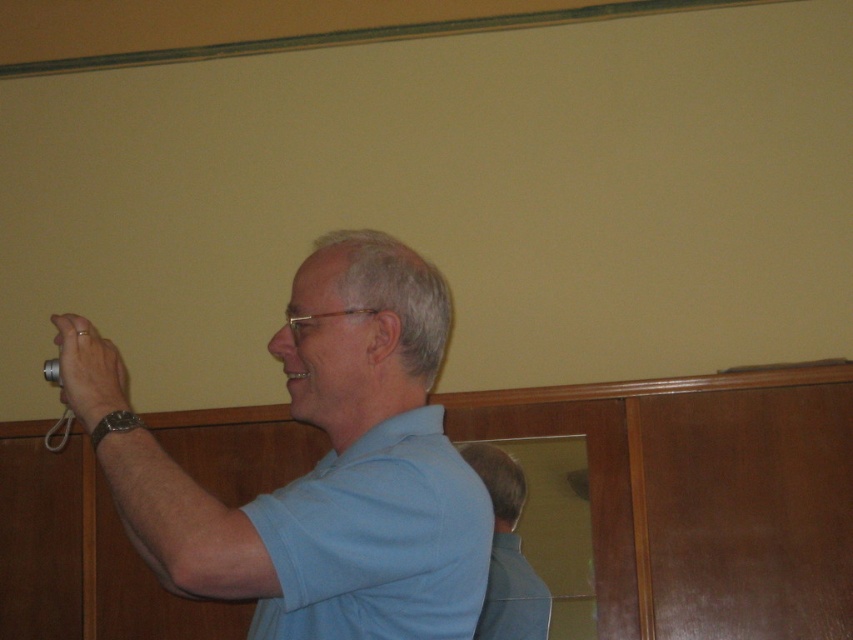
You are a photographer trying to decide which blue shirt to wear for a photoshoot. You see both the blue matte shirt at center and the blue fabric shirt at center in the image. Which one is bigger?

The blue matte shirt at center is larger in size compared to the blue fabric shirt at center.

You are a photographer trying to adjust your setup. The blue fabric shirt at center and the matte silver camera at left are in your frame. Which object is closer to the bottom edge of your camera viewfinder?

The blue fabric shirt at center is positioned under the matte silver camera at left, so the blue fabric shirt at center is closer to the bottom edge of the camera viewfinder.

You are a photographer who needs to position a light source for a photo shoot. The subject is the man in the blue matte shirt at center. Where should you place the light source to ensure it illuminates the subject effectively based on the current scene setup?

The light source should be positioned near the camera to create a well lit subject. Since the blue matte shirt at center is at point (x=332, y=470), placing the light source near the camera position would ensure effective illumination.